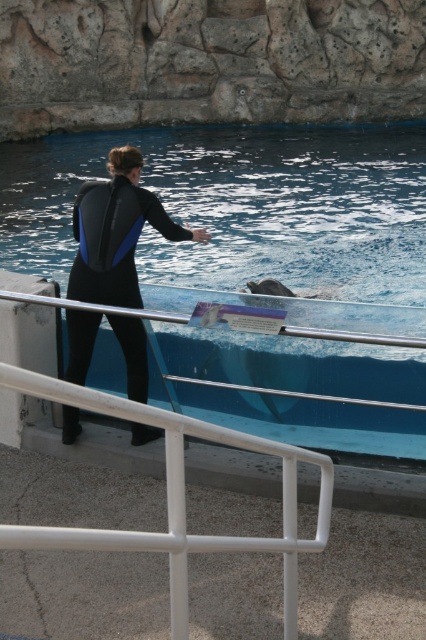
You are a visitor at the marine park and want to take a photo of the black neoprene wetsuit at center without the blue smooth pool at center blocking the view. Is this possible given their positions?

The black neoprene wetsuit at center is behind the blue smooth pool at center, so taking a clear photo of the black neoprene wetsuit at center without the blue smooth pool at center blocking the view would not be possible as the pool is in front of it.

You are a visitor at the marine park and want to take a photo of the dolphin in the blue smooth pool at center. Where should you position yourself to ensure the dolphin is clearly visible through the glass barrier?

The blue smooth pool at center is located at point (245,214), so you should position yourself directly in front of this coordinate to get a clear view of the dolphin through the glass barrier.